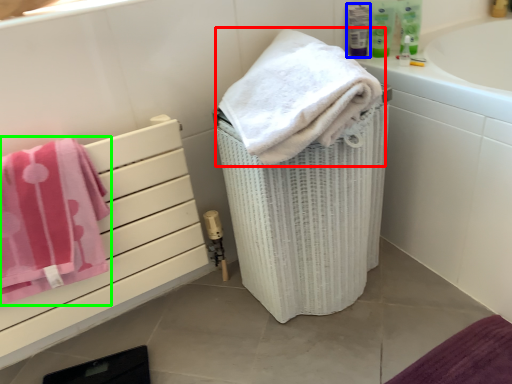
Question: Based on their relative distances, which object is nearer to towel (highlighted by a red box)? Choose from mouthwash (highlighted by a blue box) and towel (highlighted by a green box).

Choices:
 (A) mouthwash
 (B) towel

Answer: (B)